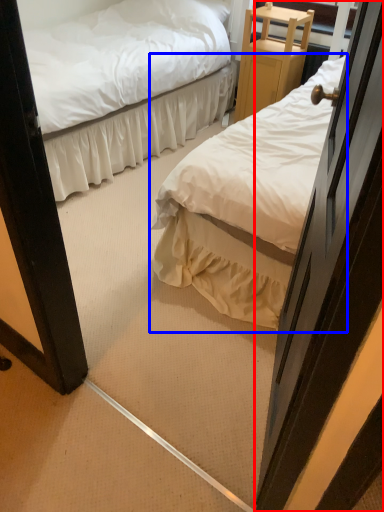
Question: Which point is further to the camera, door (highlighted by a red box) or bed (highlighted by a blue box)?

Choices:
 (A) door
 (B) bed

Answer: (B)